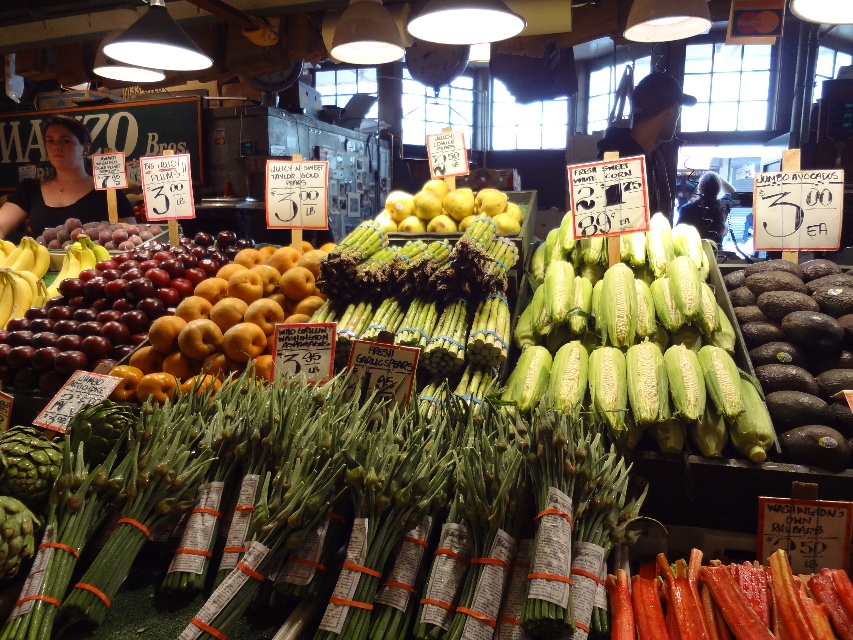
Question: Among these points, which one is nearest to the camera?

Choices:
 (A) (33, 120)
 (B) (608, 406)
 (C) (131, 320)

Answer: (B)

Question: Does shiny dark purple grapes at center left have a greater width compared to wooden signboard at upper left?

Choices:
 (A) yes
 (B) no

Answer: (B)

Question: From the image, what is the correct spatial relationship of green corn at center in relation to wooden signboard at upper left?

Choices:
 (A) below
 (B) above

Answer: (A)

Question: Based on their relative distances, which object is nearer to the yellow smooth apples at center?

Choices:
 (A) golden yellow peaches at center
 (B) shiny dark purple grapes at center left
 (C) green corn at center
 (D) wooden signboard at upper left

Answer: (C)

Question: Is golden yellow peaches at center above yellow smooth apples at center?

Choices:
 (A) yes
 (B) no

Answer: (B)

Question: Which of the following is the farthest from the observer?

Choices:
 (A) wooden signboard at upper left
 (B) green corn at center

Answer: (A)